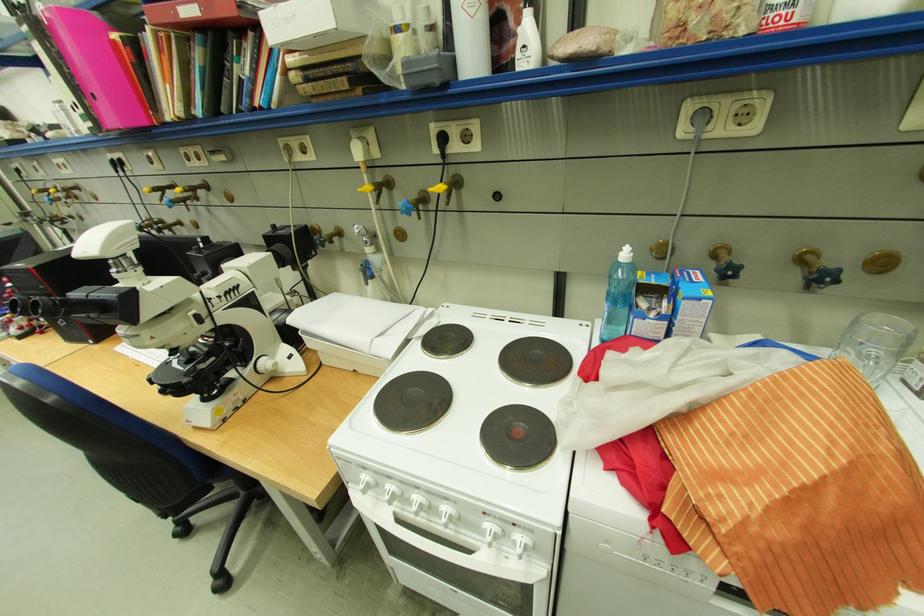
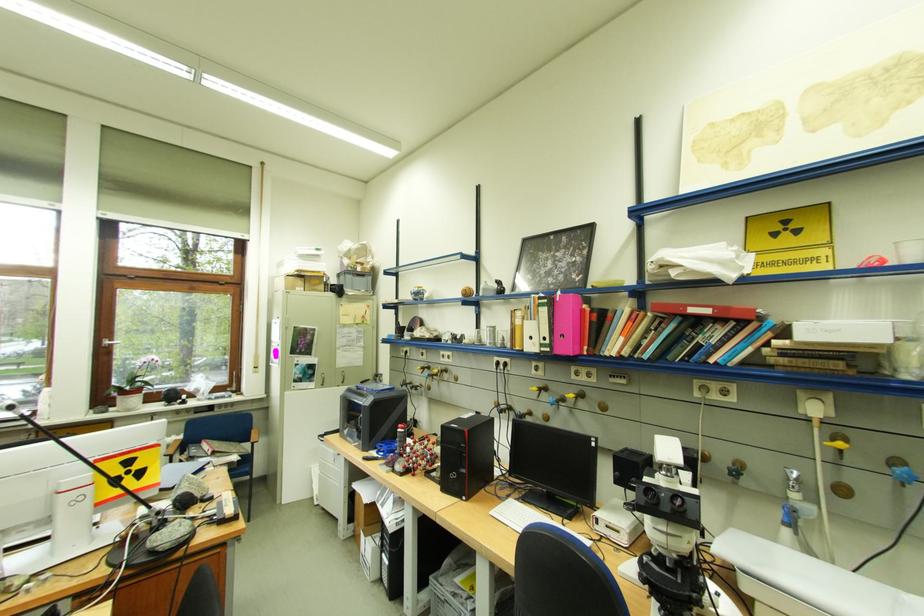
In the second image, find the point that corresponds to pixel 102 124 in the first image.

(558, 351)